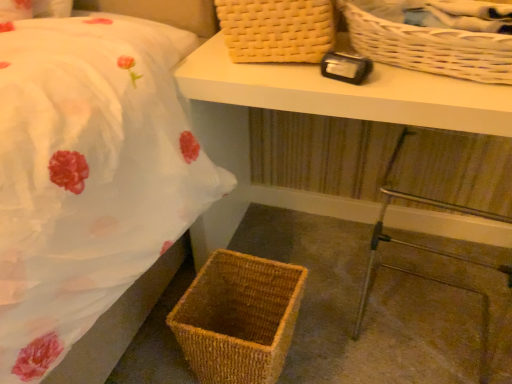
Where is `vacant area to the right of brown woven picnic basket at lower left, the 1th picnic basket ordered from the bottom`? The height and width of the screenshot is (384, 512). vacant area to the right of brown woven picnic basket at lower left, the 1th picnic basket ordered from the bottom is located at coordinates 325,343.